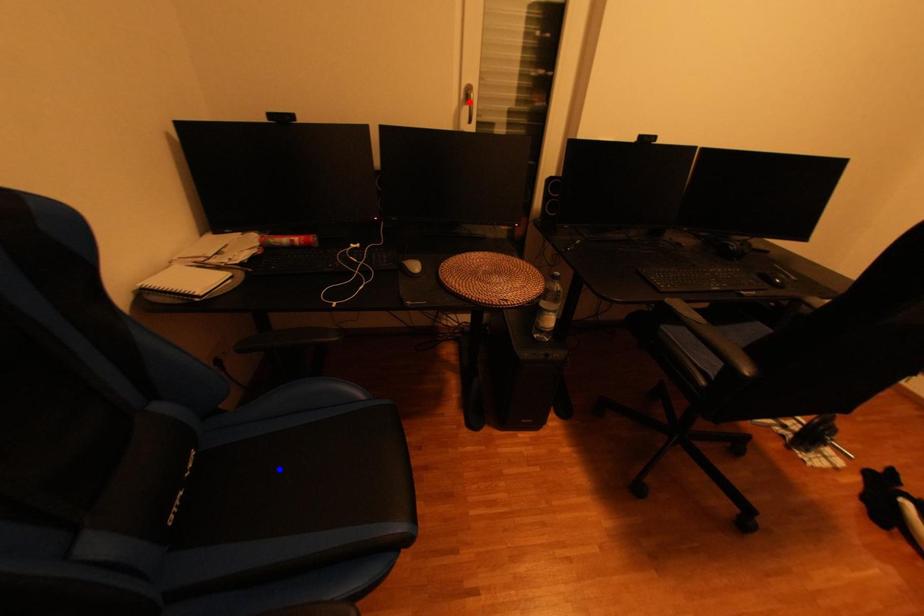
Question: In the image, two points are highlighted. Which point is nearer to the camera? Reply with the corresponding letter.

Choices:
 (A) blue point
 (B) red point

Answer: (A)